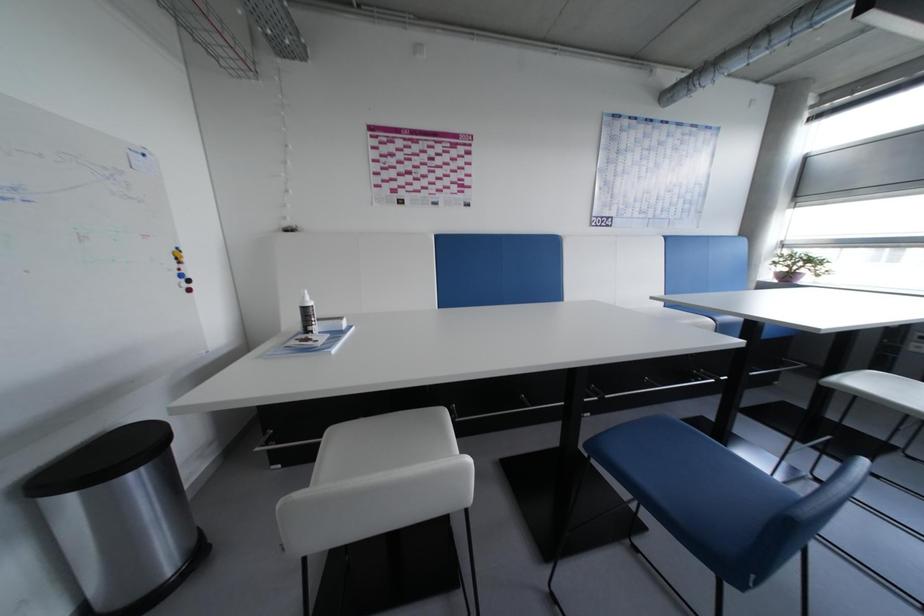
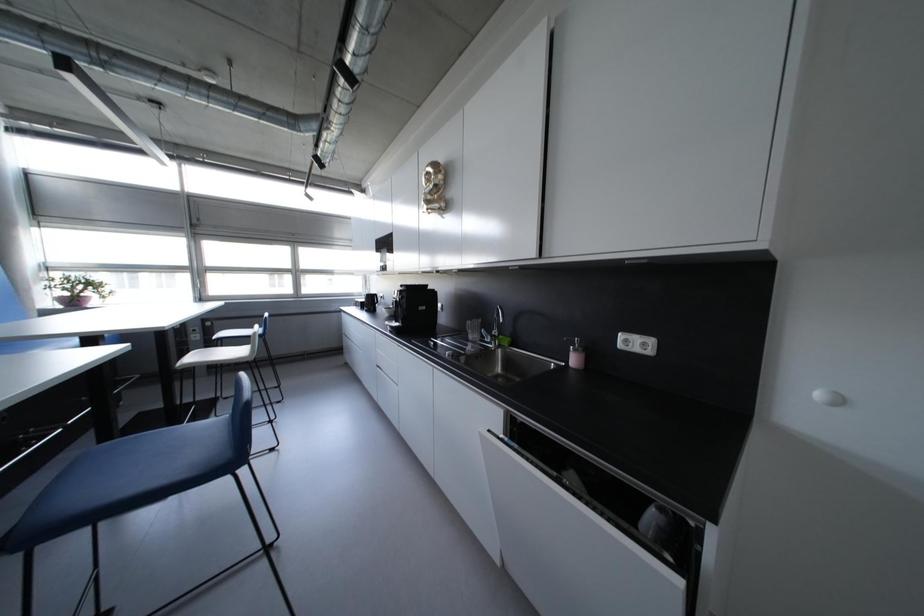
Question: The images are taken continuously from a first-person perspective. In which direction is your viewpoint rotating?

Choices:
 (A) Left
 (B) Right
 (C) Up
 (D) Down

Answer: (B)